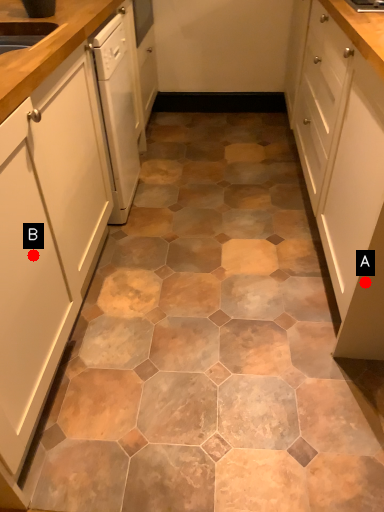
Question: Two points are circled on the image, labeled by A and B beside each circle. Which point appears closest to the camera in this image?

Choices:
 (A) A is closer
 (B) B is closer

Answer: (B)